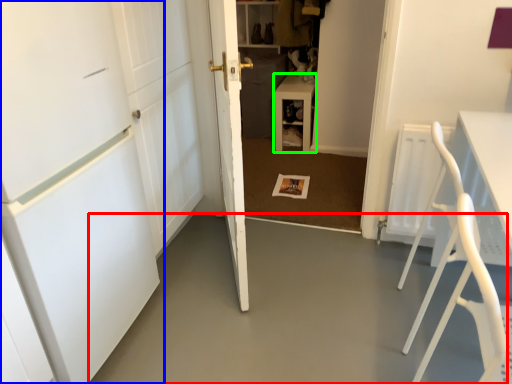
Question: Which is farther away from concrete (highlighted by a red box)? door (highlighted by a blue box) or furniture (highlighted by a green box)?

Choices:
 (A) door
 (B) furniture

Answer: (B)